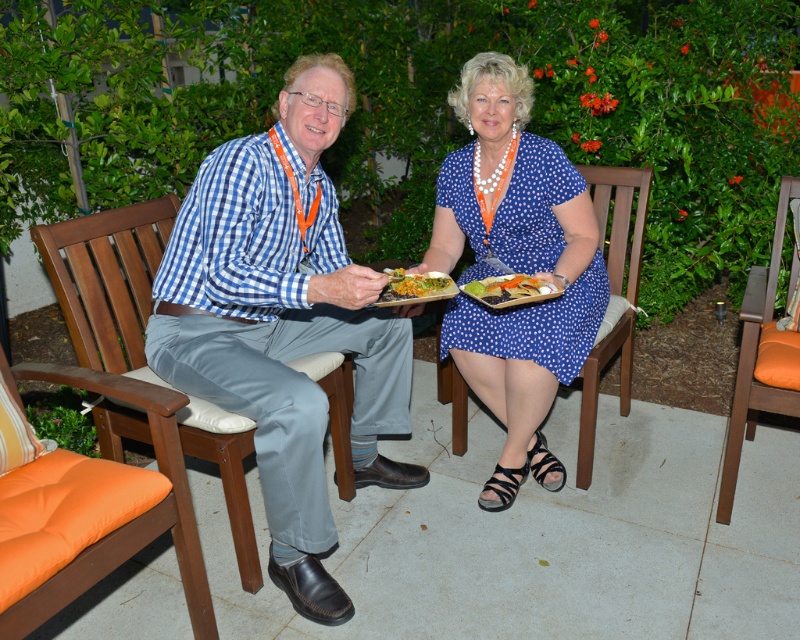
Question: Can you confirm if blue checkered shirt at center is positioned to the left of orange fabric cushion at lower right?

Choices:
 (A) no
 (B) yes

Answer: (B)

Question: In this image, where is wooden chair at left located relative to green leafy salad at center?

Choices:
 (A) below
 (B) above

Answer: (A)

Question: Is orange cushioned chair at lower left thinner than green leafy salad at center?

Choices:
 (A) no
 (B) yes

Answer: (A)

Question: Which point appears closest to the camera in this image?

Choices:
 (A) (97, 284)
 (B) (444, 282)
 (C) (730, 509)
 (D) (184, 516)

Answer: (D)

Question: Which object is closer to the camera taking this photo?

Choices:
 (A) blue dotted dress at center
 (B) green leafy salad at center
 (C) blue checkered shirt at center
 (D) wooden chair at left

Answer: (C)

Question: Which is farther from the wooden chair at left?

Choices:
 (A) blue checkered shirt at center
 (B) green leafy salad at center
 (C) orange fabric cushion at lower right
 (D) smooth green leaf at center

Answer: (C)